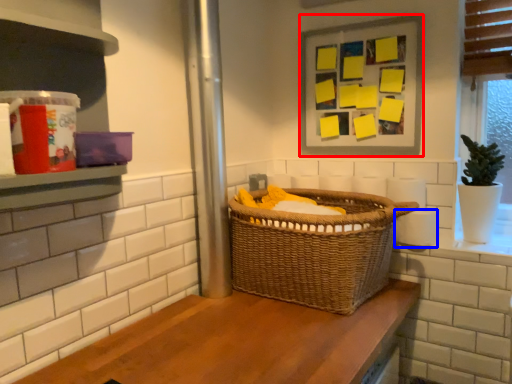
Question: Which point is further to the camera, picture frame (highlighted by a red box) or toilet paper (highlighted by a blue box)?

Choices:
 (A) picture frame
 (B) toilet paper

Answer: (A)